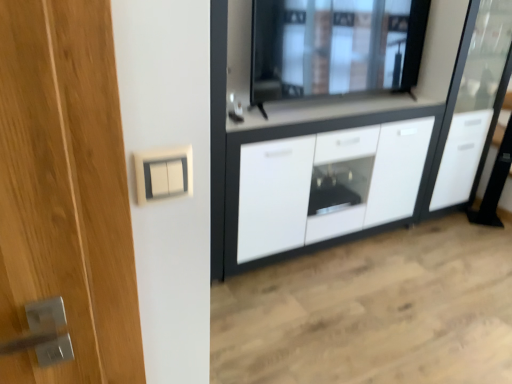
Question: Which is correct: white glossy cabinet at center is inside white plastic switch at upper center, or outside of it?

Choices:
 (A) outside
 (B) inside

Answer: (A)

Question: Would you say white glossy cabinet at center is to the left or to the right of white plastic switch at upper center in the picture?

Choices:
 (A) left
 (B) right

Answer: (B)

Question: Estimate the real-world distances between objects in this image. Which object is closer to the transparent glass window at upper center?

Choices:
 (A) white glossy cabinet at right
 (B) white glossy cabinet at center
 (C) white plastic switch at upper center

Answer: (B)

Question: Estimate the real-world distances between objects in this image. Which object is closer to the white glossy cabinet at center?

Choices:
 (A) white plastic switch at upper center
 (B) transparent glass window at upper center
 (C) white glossy cabinet at right

Answer: (B)